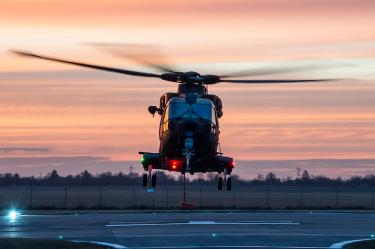
At what (x,y) coordinates should I click in order to perform the action: click on light. Please return your answer as a coordinate pair (x, y). This screenshot has width=375, height=249. Looking at the image, I should click on (14, 214).